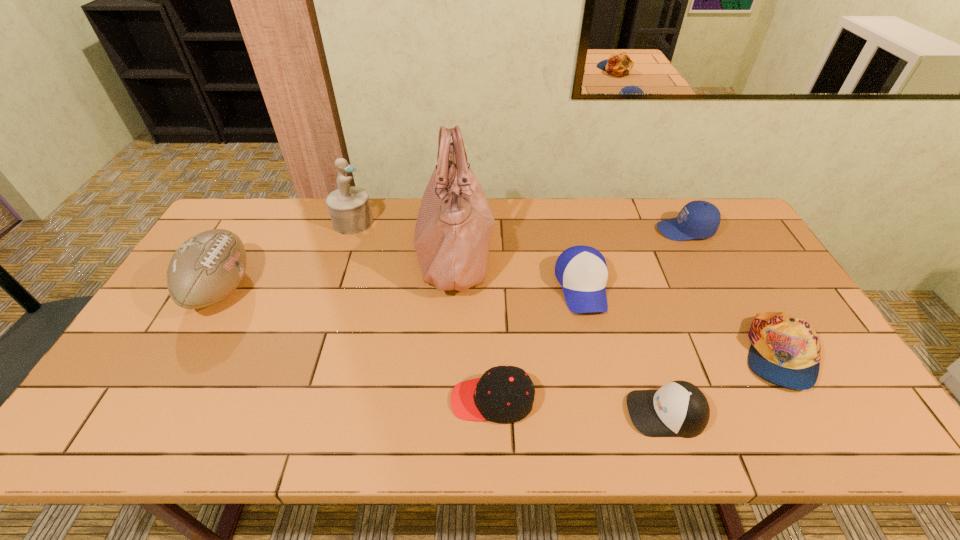
Locate an element on the screen. vacant space at the near right corner is located at coordinates (859, 421).

At what (x,y) coordinates should I click in order to perform the action: click on empty space between the leftmost cap and the third cap from right to left. Please return your answer as a coordinate pair (x, y). This screenshot has width=960, height=540. Looking at the image, I should click on (579, 407).

What are the coordinates of `free point between the third cap from right to left and the figurine` in the screenshot? It's located at (510, 318).

Where is `blank region between the leftmost cap and the third cap from right to left`? blank region between the leftmost cap and the third cap from right to left is located at coordinates (579, 407).

Identify the location of free spot between the farthest cap and the third cap from right to left. (676, 321).

I want to click on vacant region between the baseball cap and the leftmost cap, so click(x=537, y=344).

Where is `vacant region between the leftmost object and the figurine`? This screenshot has width=960, height=540. vacant region between the leftmost object and the figurine is located at coordinates (287, 255).

Select which object appears as the third closest to the farthest cap. Please provide its 2D coordinates. Your answer should be formatted as a tuple, i.e. [(x, y)], where the tuple contains the x and y coordinates of a point satisfying the conditions above.

[(678, 409)]

Point out which object is positioned as the sixth nearest to the football (American). Please provide its 2D coordinates. Your answer should be formatted as a tuple, i.e. [(x, y)], where the tuple contains the x and y coordinates of a point satisfying the conditions above.

[(698, 219)]

Locate which cap ranks third in proximity to the baseball cap. Please provide its 2D coordinates. Your answer should be formatted as a tuple, i.e. [(x, y)], where the tuple contains the x and y coordinates of a point satisfying the conditions above.

[(698, 219)]